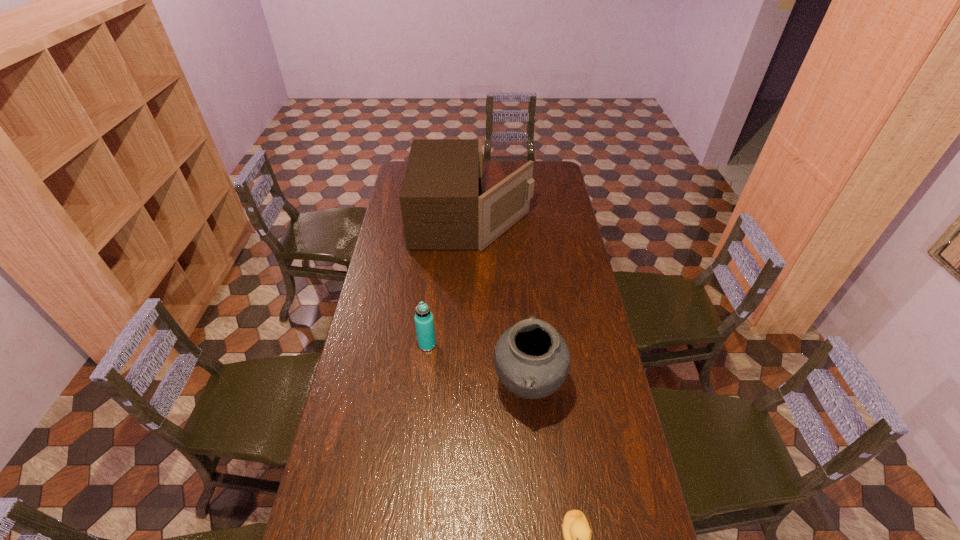
Where is `the farthest object`? This screenshot has width=960, height=540. the farthest object is located at coordinates (443, 208).

The image size is (960, 540). Find the location of `the second nearest object`. the second nearest object is located at coordinates (532, 360).

Locate an element on the screen. Image resolution: width=960 pixels, height=540 pixels. water bottle is located at coordinates (424, 322).

You are a GUI agent. You are given a task and a screenshot of the screen. Output one action in this format:
    pyautogui.click(x=<x>, y=<y>)
    Task: Click on the second farthest object
    The height and width of the screenshot is (540, 960).
    Given the screenshot: What is the action you would take?
    pyautogui.click(x=424, y=322)

This screenshot has width=960, height=540. In order to click on vacant region located 0.180m with the door open on the front of the farthest object in this screenshot , I will do `click(568, 219)`.

This screenshot has height=540, width=960. I want to click on free space located on the right of the second nearest object, so click(615, 387).

This screenshot has height=540, width=960. I want to click on free location located 0.360m on the front of the water bottle, so click(x=417, y=447).

The height and width of the screenshot is (540, 960). Find the location of `object located in the left edge section of the desktop`. object located in the left edge section of the desktop is located at coordinates (443, 208).

Find the location of a particular element. The height and width of the screenshot is (540, 960). blank space at the far edge is located at coordinates (509, 173).

The width and height of the screenshot is (960, 540). Find the location of `free space at the left edge`. free space at the left edge is located at coordinates (367, 413).